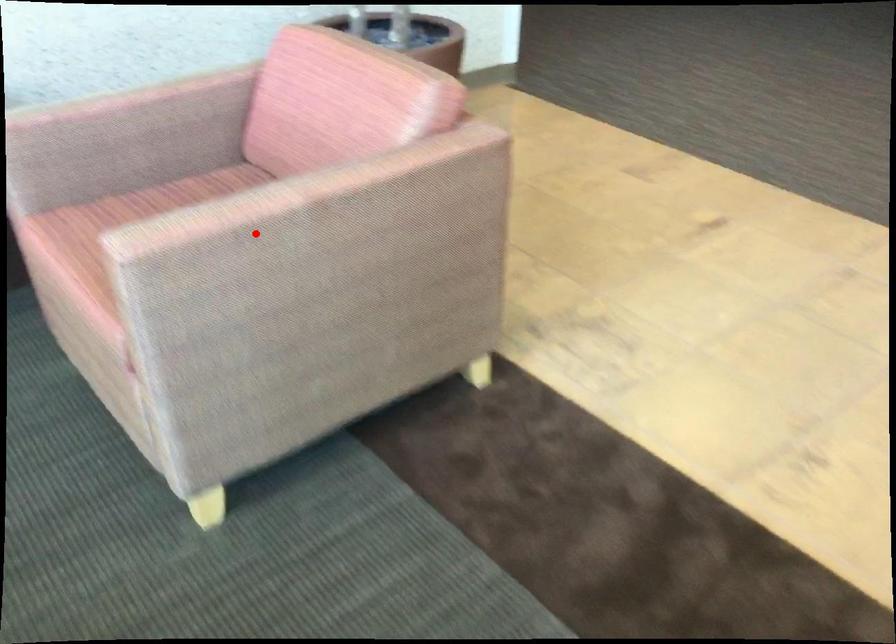
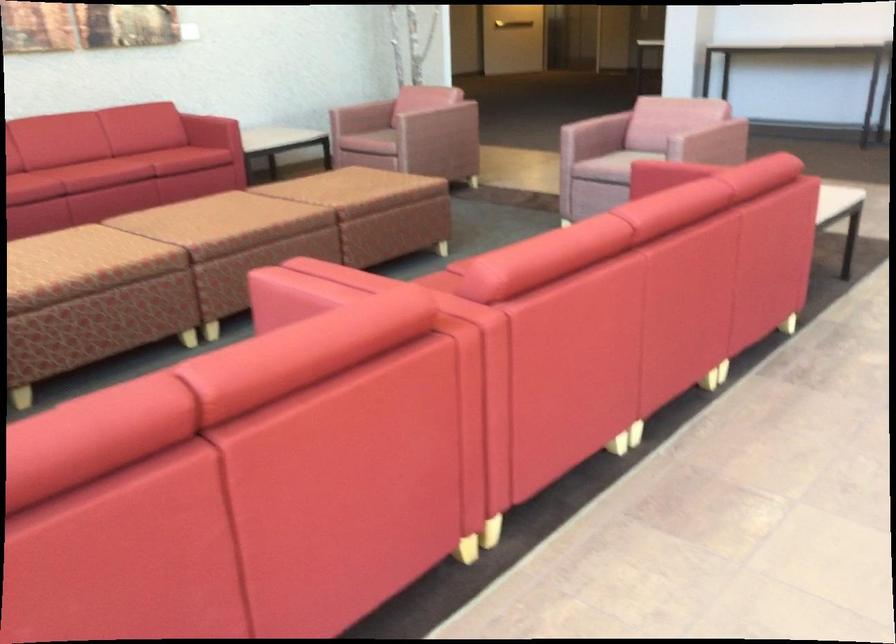
Find the pixel in the second image that matches the highlighted location in the first image.

(431, 106)